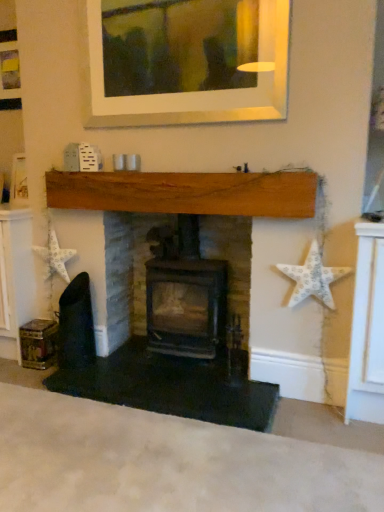
The image size is (384, 512). What are the coordinates of `white paper star at left, which is counted as the second starfish, starting from the front` in the screenshot? It's located at (54, 257).

This screenshot has width=384, height=512. What do you see at coordinates (231, 259) in the screenshot?
I see `black cast iron stove at center, placed as the 2th fireplace when sorted from left to right` at bounding box center [231, 259].

Where is `white textured star at right, the first starfish viewed from the front`? This screenshot has height=512, width=384. white textured star at right, the first starfish viewed from the front is located at coordinates (313, 277).

What are the coordinates of `white paper star at left, the first starfish viewed from the back` in the screenshot? It's located at coord(54,257).

From a real-world perspective, is white textured star at right, the second starfish when ordered from back to front, positioned under black cast iron stove at center, which appears as the first fireplace when viewed from the right, based on gravity?

No, from a real-world perspective, white textured star at right, the second starfish when ordered from back to front, is not below black cast iron stove at center, which appears as the first fireplace when viewed from the right.

Which is behind, point (308, 273) or point (134, 220)?

Point (134, 220)

Looking at the image, does white textured star at right, which is the second starfish in left-to-right order, seem bigger or smaller compared to black cast iron stove at center, which appears as the first fireplace when viewed from the right?

white textured star at right, which is the second starfish in left-to-right order, is smaller than black cast iron stove at center, which appears as the first fireplace when viewed from the right.

Does white textured star at right, the first starfish viewed from the front, have a greater height compared to black cast iron stove at center, which appears as the first fireplace when viewed from the right?

No.

Considering the sizes of objects white textured star at right, the first starfish from the right, and wooden fireplace at center, which is counted as the second fireplace, starting from the right, in the image provided, who is shorter, white textured star at right, the first starfish from the right, or wooden fireplace at center, which is counted as the second fireplace, starting from the right,?

With less height is white textured star at right, the first starfish from the right.

Does white textured star at right, the first starfish from the right, appear on the left side of wooden fireplace at center, which is counted as the first fireplace, starting from the left?

Incorrect, white textured star at right, the first starfish from the right, is not on the left side of wooden fireplace at center, which is counted as the first fireplace, starting from the left.

Between white textured star at right, the second starfish when ordered from back to front, and wooden fireplace at center, which is counted as the first fireplace, starting from the left, which one has smaller size?

white textured star at right, the second starfish when ordered from back to front, is smaller.

Could you tell me if white textured star at right, the first starfish from the right, is turned towards wooden fireplace at center, which is counted as the first fireplace, starting from the left?

No.

Find the location of a particular element. fireplace below the wooden fireplace at center, which is counted as the first fireplace, starting from the left (from the image's perspective) is located at coordinates (231, 259).

Can you tell me how much wooden fireplace at center, which is counted as the second fireplace, starting from the right, and black cast iron stove at center, placed as the 2th fireplace when sorted from left to right, differ in facing direction?

The facing directions of wooden fireplace at center, which is counted as the second fireplace, starting from the right, and black cast iron stove at center, placed as the 2th fireplace when sorted from left to right, are 1.02 degrees apart.

Is wooden fireplace at center, which is counted as the second fireplace, starting from the right, aimed at black cast iron stove at center, placed as the 2th fireplace when sorted from left to right?

Yes, wooden fireplace at center, which is counted as the second fireplace, starting from the right, is aimed at black cast iron stove at center, placed as the 2th fireplace when sorted from left to right.

Which of these two, wooden fireplace at center, which is counted as the second fireplace, starting from the right, or black cast iron stove at center, which appears as the first fireplace when viewed from the right, is smaller?

With smaller size is wooden fireplace at center, which is counted as the second fireplace, starting from the right.

Image resolution: width=384 pixels, height=512 pixels. In order to click on starfish behind the black cast iron stove at center, which appears as the first fireplace when viewed from the right in this screenshot , I will do `click(54, 257)`.

Are black cast iron stove at center, which appears as the first fireplace when viewed from the right, and white paper star at left, which appears as the first starfish when viewed from the left, making contact?

No, black cast iron stove at center, which appears as the first fireplace when viewed from the right, is not next to white paper star at left, which appears as the first starfish when viewed from the left.

Looking at this image, does black cast iron stove at center, which appears as the first fireplace when viewed from the right, have a lesser height compared to white paper star at left, the second starfish when ordered from right to left?

No.

Are white paper star at left, which is counted as the second starfish, starting from the front, and wooden fireplace at center, which is counted as the first fireplace, starting from the left, beside each other?

They are not placed beside each other.

In the scene shown: Could you measure the distance between white paper star at left, which is counted as the second starfish, starting from the front, and wooden fireplace at center, which is counted as the second fireplace, starting from the right?

26.29 inches.

Is the position of white paper star at left, the second starfish when ordered from right to left, less distant than that of wooden fireplace at center, which is counted as the first fireplace, starting from the left?

No, the depth of white paper star at left, the second starfish when ordered from right to left, is greater than that of wooden fireplace at center, which is counted as the first fireplace, starting from the left.

The image size is (384, 512). There is a white paper star at left, the first starfish viewed from the back. What are the coordinates of `the 1st fireplace below it (from the image's perspective)` in the screenshot? It's located at (173, 282).

Is wooden fireplace at center, which is counted as the second fireplace, starting from the right, turned away from white paper star at left, which appears as the first starfish when viewed from the left?

Yes, wooden fireplace at center, which is counted as the second fireplace, starting from the right, is facing away from white paper star at left, which appears as the first starfish when viewed from the left.

How different are the orientations of wooden fireplace at center, which is counted as the second fireplace, starting from the right, and white paper star at left, the second starfish when ordered from right to left, in degrees?

The facing directions of wooden fireplace at center, which is counted as the second fireplace, starting from the right, and white paper star at left, the second starfish when ordered from right to left, are 0.446 degrees apart.

Is wooden fireplace at center, which is counted as the first fireplace, starting from the left, spatially inside white paper star at left, the first starfish viewed from the back, or outside of it?

wooden fireplace at center, which is counted as the first fireplace, starting from the left, exists outside the volume of white paper star at left, the first starfish viewed from the back.

From a real-world perspective, which is physically above, wooden fireplace at center, which is counted as the first fireplace, starting from the left, or white paper star at left, which appears as the first starfish when viewed from the left?

white paper star at left, which appears as the first starfish when viewed from the left.

Which object is thinner, black cast iron stove at center, which appears as the first fireplace when viewed from the right, or white textured star at right, the first starfish viewed from the front?

white textured star at right, the first starfish viewed from the front.

Considering the sizes of objects black cast iron stove at center, which appears as the first fireplace when viewed from the right, and white textured star at right, which is the second starfish in left-to-right order, in the image provided, who is shorter, black cast iron stove at center, which appears as the first fireplace when viewed from the right, or white textured star at right, which is the second starfish in left-to-right order,?

With less height is white textured star at right, which is the second starfish in left-to-right order.

Is white textured star at right, the second starfish when ordered from back to front, at the back of black cast iron stove at center, placed as the 2th fireplace when sorted from left to right?

No, black cast iron stove at center, placed as the 2th fireplace when sorted from left to right,'s orientation is not away from white textured star at right, the second starfish when ordered from back to front.

Considering the relative sizes of black cast iron stove at center, placed as the 2th fireplace when sorted from left to right, and white textured star at right, the first starfish viewed from the front, in the image provided, is black cast iron stove at center, placed as the 2th fireplace when sorted from left to right, bigger than white textured star at right, the first starfish viewed from the front,?

Yes, black cast iron stove at center, placed as the 2th fireplace when sorted from left to right, is bigger than white textured star at right, the first starfish viewed from the front.

Identify the location of starfish in front of the black cast iron stove at center, placed as the 2th fireplace when sorted from left to right. The image size is (384, 512). (313, 277).

Locate an element on the screen. starfish that appears on the right of wooden fireplace at center, which is counted as the second fireplace, starting from the right is located at coordinates (313, 277).

Which object lies further to the anchor point white paper star at left, the first starfish viewed from the back, white textured star at right, the second starfish when ordered from back to front, or wooden fireplace at center, which is counted as the first fireplace, starting from the left?

white textured star at right, the second starfish when ordered from back to front, is further to white paper star at left, the first starfish viewed from the back.

Based on their spatial positions, is black cast iron stove at center, which appears as the first fireplace when viewed from the right, or wooden fireplace at center, which is counted as the second fireplace, starting from the right, further from white paper star at left, which appears as the first starfish when viewed from the left?

black cast iron stove at center, which appears as the first fireplace when viewed from the right.

Based on the photo, estimate the real-world distances between objects in this image. Which object is closer to black cast iron stove at center, which appears as the first fireplace when viewed from the right, white paper star at left, which is counted as the second starfish, starting from the front, or white textured star at right, which is the second starfish in left-to-right order?

white textured star at right, which is the second starfish in left-to-right order.

Which object lies nearer to the anchor point black cast iron stove at center, placed as the 2th fireplace when sorted from left to right, white textured star at right, the second starfish when ordered from back to front, or white paper star at left, which appears as the first starfish when viewed from the left?

white textured star at right, the second starfish when ordered from back to front, lies closer to black cast iron stove at center, placed as the 2th fireplace when sorted from left to right, than the other object.

Looking at the image, which one is located closer to white textured star at right, the second starfish when ordered from back to front, wooden fireplace at center, which is counted as the first fireplace, starting from the left, or white paper star at left, which is counted as the second starfish, starting from the front?

wooden fireplace at center, which is counted as the first fireplace, starting from the left.

Looking at this image, from the image, which object appears to be nearer to white paper star at left, the first starfish viewed from the back, wooden fireplace at center, which is counted as the first fireplace, starting from the left, or white textured star at right, the first starfish from the right?

Based on the image, wooden fireplace at center, which is counted as the first fireplace, starting from the left, appears to be nearer to white paper star at left, the first starfish viewed from the back.

Looking at the image, which one is located closer to wooden fireplace at center, which is counted as the first fireplace, starting from the left, white textured star at right, the second starfish when ordered from back to front, or black cast iron stove at center, placed as the 2th fireplace when sorted from left to right?

black cast iron stove at center, placed as the 2th fireplace when sorted from left to right.

When comparing their distances from white textured star at right, the first starfish viewed from the front, does black cast iron stove at center, placed as the 2th fireplace when sorted from left to right, or wooden fireplace at center, which is counted as the first fireplace, starting from the left, seem closer?

black cast iron stove at center, placed as the 2th fireplace when sorted from left to right, is closer to white textured star at right, the first starfish viewed from the front.

You are a GUI agent. You are given a task and a screenshot of the screen. Output one action in this format:
    pyautogui.click(x=<x>, y=<y>)
    Task: Click on the fireplace situated between wooden fireplace at center, which is counted as the second fireplace, starting from the right, and white textured star at right, the first starfish from the right, from left to right
    
    Given the screenshot: What is the action you would take?
    pyautogui.click(x=231, y=259)

The image size is (384, 512). Find the location of `fireplace between white paper star at left, which appears as the first starfish when viewed from the left, and black cast iron stove at center, placed as the 2th fireplace when sorted from left to right, in the horizontal direction`. fireplace between white paper star at left, which appears as the first starfish when viewed from the left, and black cast iron stove at center, placed as the 2th fireplace when sorted from left to right, in the horizontal direction is located at coordinates (173, 282).